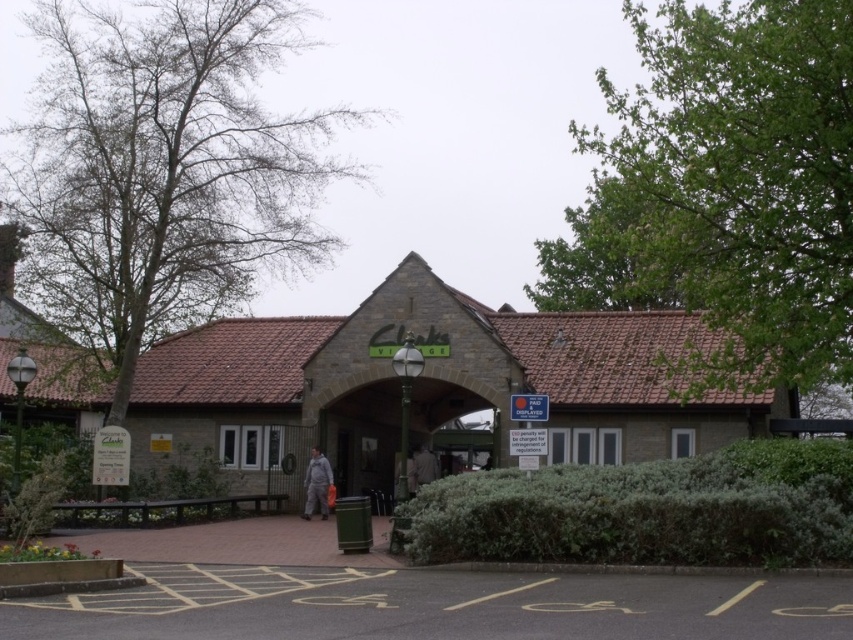
Question: Which is farther from the gray fabric jacket at center?

Choices:
 (A) metallic gate at center
 (B) green leafy hedge at lower center
 (C) light brown leather jacket at center

Answer: (B)

Question: Does green leafy hedge at lower center appear under gray fabric jacket at center?

Choices:
 (A) no
 (B) yes

Answer: (A)

Question: Is the position of green leafy hedge at lower center less distant than that of light brown leather jacket at center?

Choices:
 (A) no
 (B) yes

Answer: (B)

Question: Can you confirm if metallic gate at center is thinner than light brown leather jacket at center?

Choices:
 (A) no
 (B) yes

Answer: (A)

Question: Among these objects, which one is farthest from the camera?

Choices:
 (A) light brown leather jacket at center
 (B) gray fabric jacket at center

Answer: (A)

Question: Which of the following is the closest to the observer?

Choices:
 (A) (474, 406)
 (B) (323, 464)
 (C) (525, 552)

Answer: (C)